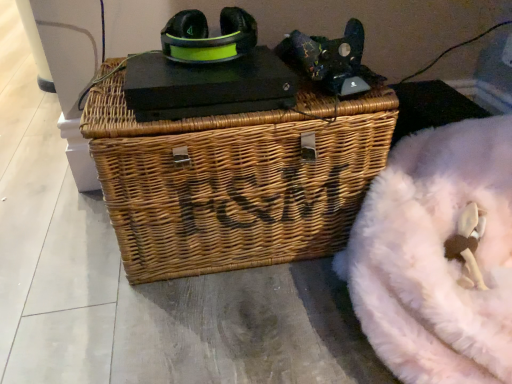
Question: From the image's perspective, is velvet-like pink bean bag at upper right, positioned as the 1th bean bag chair in top-to-bottom order, over matte green plastic headphones at upper center?

Choices:
 (A) no
 (B) yes

Answer: (A)

Question: Does velvet-like pink bean bag at upper right, acting as the 2th bean bag chair starting from the bottom, touch matte green plastic headphones at upper center?

Choices:
 (A) no
 (B) yes

Answer: (A)

Question: Is matte green plastic headphones at upper center inside velvet-like pink bean bag at upper right, positioned as the 1th bean bag chair in top-to-bottom order?

Choices:
 (A) yes
 (B) no

Answer: (B)

Question: Considering the relative sizes of velvet-like pink bean bag at upper right, positioned as the 1th bean bag chair in top-to-bottom order, and matte green plastic headphones at upper center in the image provided, is velvet-like pink bean bag at upper right, positioned as the 1th bean bag chair in top-to-bottom order, thinner than matte green plastic headphones at upper center?

Choices:
 (A) yes
 (B) no

Answer: (A)

Question: Is velvet-like pink bean bag at upper right, positioned as the 1th bean bag chair in top-to-bottom order, far away from matte green plastic headphones at upper center?

Choices:
 (A) yes
 (B) no

Answer: (B)

Question: Is matte green plastic headphones at upper center wider or thinner than white fluffy bean bag at lower right, positioned as the second bean bag chair in top-to-bottom order?

Choices:
 (A) wide
 (B) thin

Answer: (B)

Question: Is matte green plastic headphones at upper center situated inside white fluffy bean bag at lower right, which is the 1th bean bag chair from bottom to top, or outside?

Choices:
 (A) outside
 (B) inside

Answer: (A)

Question: Considering the positions of matte green plastic headphones at upper center and white fluffy bean bag at lower right, which is the 1th bean bag chair from bottom to top, in the image, is matte green plastic headphones at upper center bigger or smaller than white fluffy bean bag at lower right, which is the 1th bean bag chair from bottom to top,?

Choices:
 (A) small
 (B) big

Answer: (A)

Question: From the image's perspective, relative to white fluffy bean bag at lower right, which is the 1th bean bag chair from bottom to top, is matte green plastic headphones at upper center above or below?

Choices:
 (A) above
 (B) below

Answer: (A)

Question: Is point (332, 61) positioned closer to the camera than point (370, 228)?

Choices:
 (A) farther
 (B) closer

Answer: (A)

Question: Considering the positions of velvet-like pink bean bag at upper right, positioned as the 1th bean bag chair in top-to-bottom order, and white fluffy bean bag at lower right, which is the 1th bean bag chair from bottom to top, in the image, is velvet-like pink bean bag at upper right, positioned as the 1th bean bag chair in top-to-bottom order, taller or shorter than white fluffy bean bag at lower right, which is the 1th bean bag chair from bottom to top,?

Choices:
 (A) short
 (B) tall

Answer: (A)

Question: Is velvet-like pink bean bag at upper right, positioned as the 1th bean bag chair in top-to-bottom order, bigger or smaller than white fluffy bean bag at lower right, positioned as the second bean bag chair in top-to-bottom order?

Choices:
 (A) big
 (B) small

Answer: (B)

Question: From the image's perspective, is velvet-like pink bean bag at upper right, positioned as the 1th bean bag chair in top-to-bottom order, located above or below white fluffy bean bag at lower right, positioned as the second bean bag chair in top-to-bottom order?

Choices:
 (A) below
 (B) above

Answer: (B)

Question: Would you say white fluffy bean bag at lower right, positioned as the second bean bag chair in top-to-bottom order, is to the left or to the right of woven brown picnic basket at center in the picture?

Choices:
 (A) right
 (B) left

Answer: (A)

Question: From a real-world perspective, is white fluffy bean bag at lower right, which is the 1th bean bag chair from bottom to top, above or below woven brown picnic basket at center?

Choices:
 (A) below
 (B) above

Answer: (A)